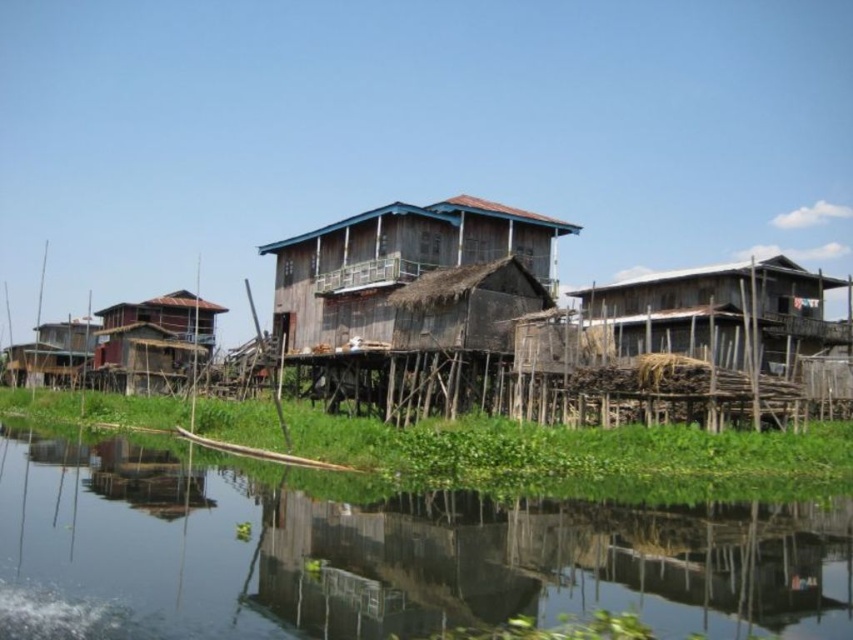
Based on the photo, you are a visitor at the riverside and want to take a photo of the wooden hut at center without the green grassy river at center appearing in the frame. Is it possible to do so?

The green grassy river at center is positioned under the wooden hut at center, so it is possible to take a photo of the wooden hut at center without the green grassy river at center by angling the camera upwards to avoid capturing the river below.

You are standing on a path near the brown wooden hut at right and want to cross to the other side of the green grassy river at center. Is the river in front of the hut passable for walking?

The green grassy river at center is in front of the brown wooden hut at right, so the river is between you and the hut. Since the river is calm and the water is still, it might be possible to walk across it, but caution is advised due to the slippery surface of the water.